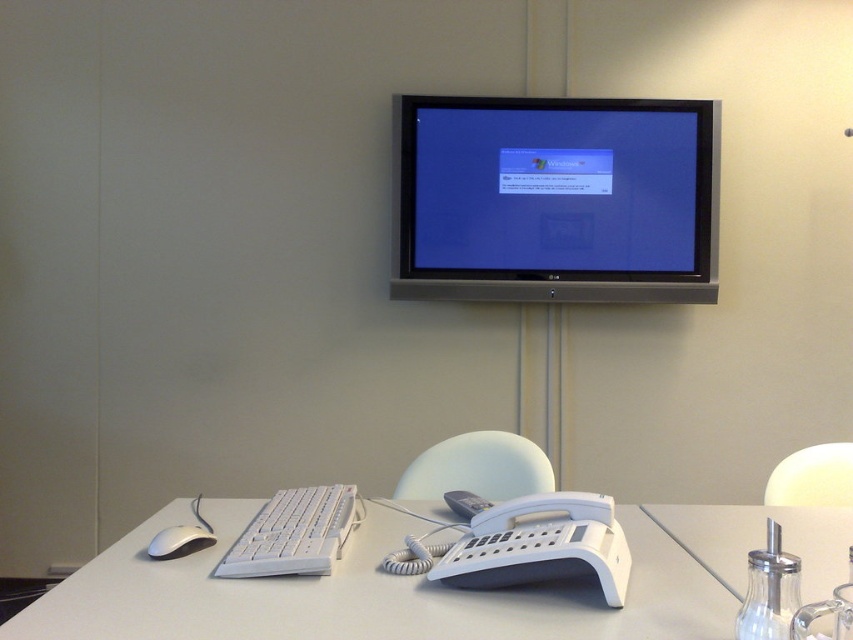
Question: Estimate the real-world distances between objects in this image. Which object is farther from the white matte mouse at lower left?

Choices:
 (A) white plastic table at lower center
 (B) clear glass bottle at lower right

Answer: (B)

Question: Which of the following is the closest to the observer?

Choices:
 (A) (161, 593)
 (B) (254, 568)
 (C) (691, 529)

Answer: (A)

Question: Which object is positioned closest to the black glossy monitor at upper center?

Choices:
 (A) white plastic table at lower center
 (B) white plastic keyboard at lower left
 (C) white matte mouse at lower left

Answer: (A)

Question: Can you confirm if white plastic keyboard at lower left is bigger than white matte mouse at lower left?

Choices:
 (A) yes
 (B) no

Answer: (A)

Question: Does black glossy monitor at upper center appear over white matte mouse at lower left?

Choices:
 (A) no
 (B) yes

Answer: (B)

Question: Observing the image, what is the correct spatial positioning of black glossy monitor at upper center in reference to clear glass bottle at lower right?

Choices:
 (A) left
 (B) right

Answer: (A)